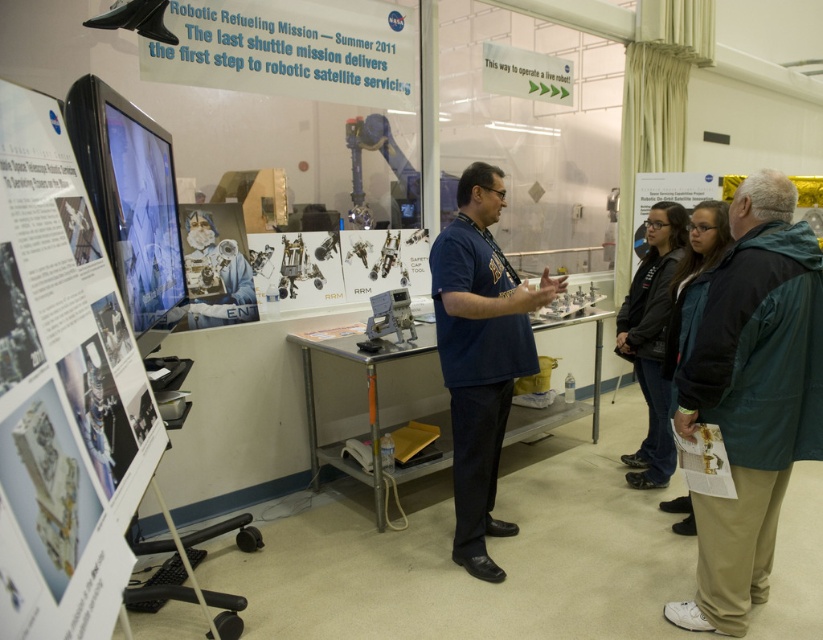
Question: Is blue paper at upper center further to camera compared to dark blue jacket at center?

Choices:
 (A) no
 (B) yes

Answer: (B)

Question: Can you confirm if white paper at left is positioned to the left of black jacket at center?

Choices:
 (A) no
 (B) yes

Answer: (B)

Question: Which point is closer to the camera?

Choices:
 (A) (616, 342)
 (B) (58, 308)
 (C) (496, 301)

Answer: (B)

Question: Which of the following is the closest to the observer?

Choices:
 (A) green fabric jacket at lower right
 (B) blue fabric shirt at center
 (C) green plastic sign at upper center

Answer: (A)

Question: In this image, where is blue fabric shirt at center located relative to dark blue jacket at center?

Choices:
 (A) below
 (B) above

Answer: (A)

Question: Among these points, which one is farthest from the camera?

Choices:
 (A) (715, 220)
 (B) (800, 374)

Answer: (A)